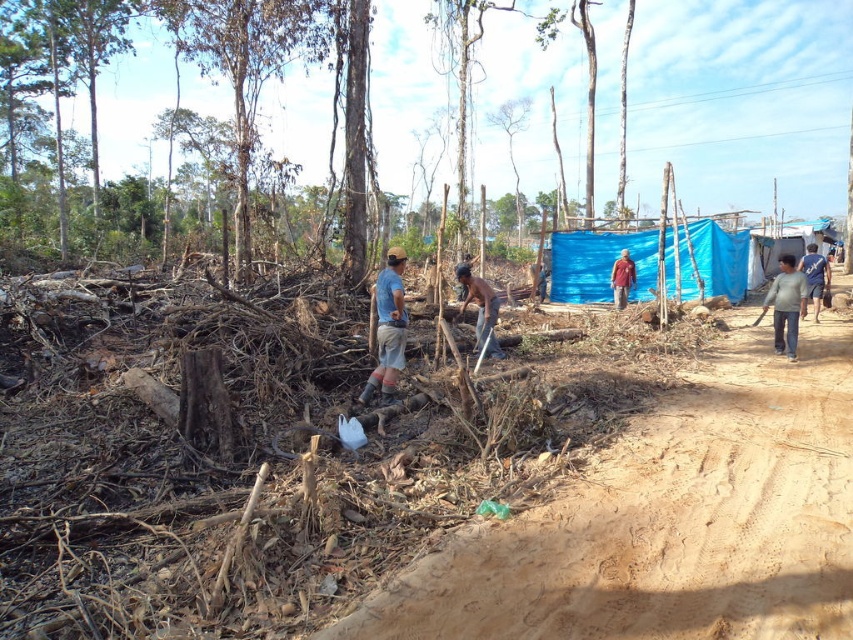
Question: Is skinny man at center above brown fabric shirt at center-right?

Choices:
 (A) yes
 (B) no

Answer: (B)

Question: From the image, what is the correct spatial relationship of rough bark tree at center in relation to blue fabric at right?

Choices:
 (A) below
 (B) above

Answer: (B)

Question: Is blue fabric cap at center behind brown fabric shirt at center-right?

Choices:
 (A) yes
 (B) no

Answer: (B)

Question: Which of the following is the farthest from the observer?

Choices:
 (A) (624, 266)
 (B) (368, 394)
 (C) (109, 246)
 (D) (804, 257)

Answer: (C)

Question: Which object is positioned farthest from the blue fabric at right?

Choices:
 (A) rough bark tree at center
 (B) skinny man at center
 (C) brown sandy dirt at center

Answer: (A)

Question: Which of the following is the closest to the observer?

Choices:
 (A) blue fabric cap at center
 (B) skinny man at center

Answer: (A)